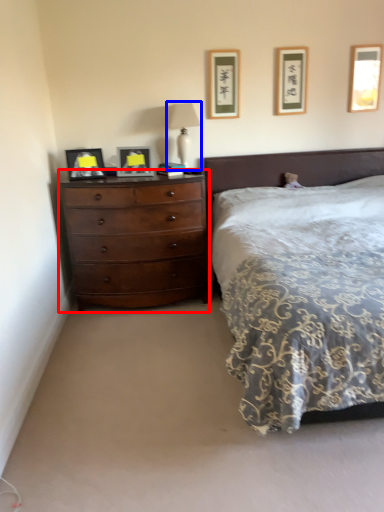
Question: Which object appears farthest to the camera in this image, chest of drawers (highlighted by a red box) or bedside lamp (highlighted by a blue box)?

Choices:
 (A) chest of drawers
 (B) bedside lamp

Answer: (B)